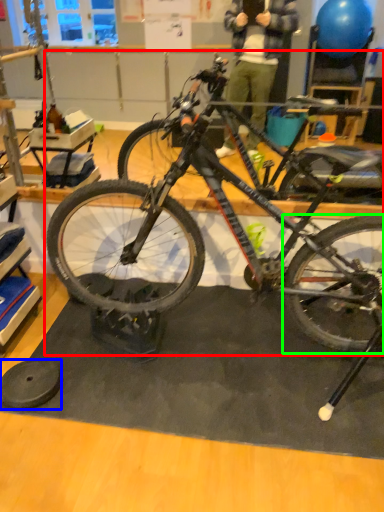
Question: Which object is the closest to the bicycle (highlighted by a red box)? Choose among these: wheel (highlighted by a blue box) or bicycle wheel (highlighted by a green box).

Choices:
 (A) wheel
 (B) bicycle wheel

Answer: (B)